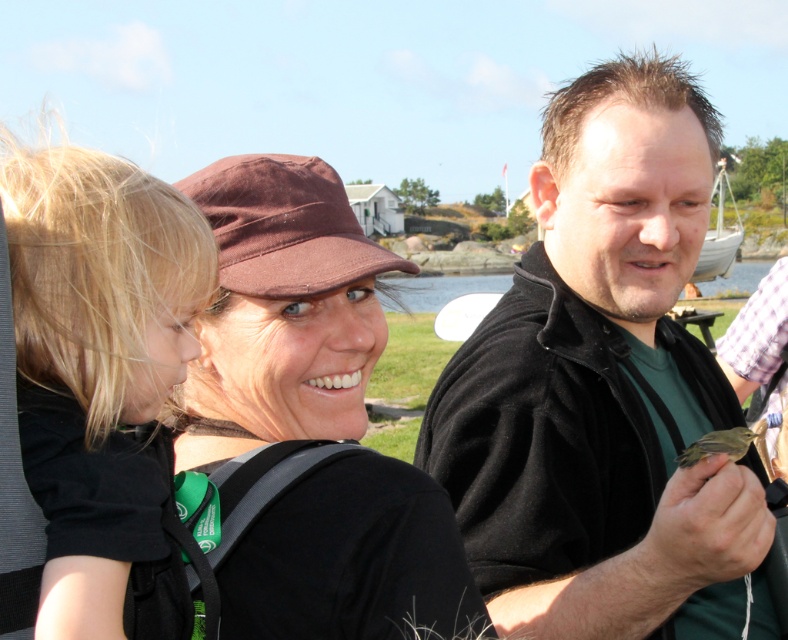
Is black softshell jacket at center positioned at the back of blonde hair at left?

Yes, black softshell jacket at center is further from the viewer.

Measure the distance between black softshell jacket at center and blonde hair at left.

The distance of black softshell jacket at center from blonde hair at left is 2.94 meters.

Identify the location of black softshell jacket at center. (604, 388).

Who is taller, black softshell jacket at center or brown feathered bird at center?

Standing taller between the two is black softshell jacket at center.

Who is more forward, (642, 538) or (727, 435)?

Point (727, 435)

Measure the distance between black softshell jacket at center and camera.

A distance of 15.19 feet exists between black softshell jacket at center and camera.

Identify the location of black softshell jacket at center. (604, 388).

Who is taller, blonde hair at left or brown feathered bird at center?

blonde hair at left is taller.

This screenshot has height=640, width=788. I want to click on blonde hair at left, so click(x=98, y=349).